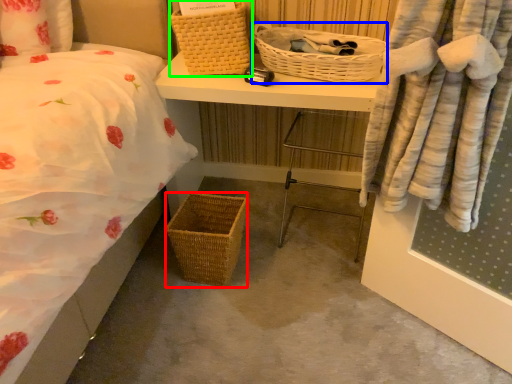
Question: Which is nearer to the picnic basket (highlighted by a red box)? picnic basket (highlighted by a blue box) or picnic basket (highlighted by a green box).

Choices:
 (A) picnic basket
 (B) picnic basket

Answer: (B)